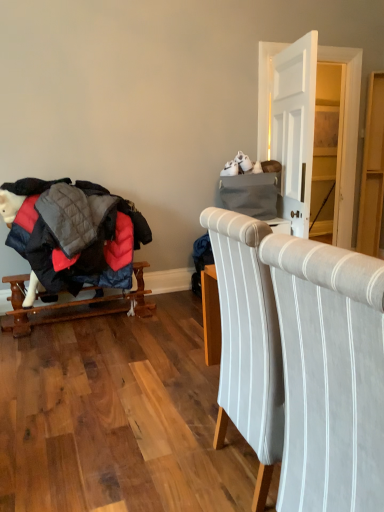
Question: Is matte gray dresser at upper right, arranged as the 1th dresser when viewed from the left, not inside light gray striped fabric chair at center?

Choices:
 (A) no
 (B) yes

Answer: (B)

Question: From the image's perspective, would you say matte gray dresser at upper right, the 2th dresser when ordered from right to left, is positioned over light gray striped fabric chair at center?

Choices:
 (A) no
 (B) yes

Answer: (B)

Question: Is matte gray dresser at upper right, the 2th dresser when ordered from right to left, facing towards light gray striped fabric chair at center?

Choices:
 (A) yes
 (B) no

Answer: (B)

Question: Is light gray striped fabric chair at center located within matte gray dresser at upper right, arranged as the 1th dresser when viewed from the left?

Choices:
 (A) yes
 (B) no

Answer: (B)

Question: Is matte gray dresser at upper right, arranged as the 1th dresser when viewed from the left, taller than light gray striped fabric chair at center?

Choices:
 (A) yes
 (B) no

Answer: (A)

Question: From the image's perspective, relative to wooden rocking horse at left, is light wood dresser at right, the first dresser in the right-to-left sequence, above or below?

Choices:
 (A) above
 (B) below

Answer: (A)

Question: In the image, is light wood dresser at right, the first dresser in the right-to-left sequence, positioned in front of or behind wooden rocking horse at left?

Choices:
 (A) front
 (B) behind

Answer: (B)

Question: Based on their sizes in the image, would you say light wood dresser at right, the first dresser in the right-to-left sequence, is bigger or smaller than wooden rocking horse at left?

Choices:
 (A) small
 (B) big

Answer: (A)

Question: Is light wood dresser at right, which appears as the second dresser when viewed from the left, taller or shorter than wooden rocking horse at left?

Choices:
 (A) short
 (B) tall

Answer: (B)

Question: In terms of size, does light wood dresser at right, which appears as the second dresser when viewed from the left, appear bigger or smaller than matte gray dresser at upper right, arranged as the 1th dresser when viewed from the left?

Choices:
 (A) small
 (B) big

Answer: (A)

Question: Considering their positions, is light wood dresser at right, which appears as the second dresser when viewed from the left, located in front of or behind matte gray dresser at upper right, the 2th dresser when ordered from right to left?

Choices:
 (A) front
 (B) behind

Answer: (B)

Question: From a real-world perspective, is light wood dresser at right, which appears as the second dresser when viewed from the left, above or below matte gray dresser at upper right, arranged as the 1th dresser when viewed from the left?

Choices:
 (A) above
 (B) below

Answer: (B)

Question: Which is correct: light wood dresser at right, the first dresser in the right-to-left sequence, is inside matte gray dresser at upper right, the 2th dresser when ordered from right to left, or outside of it?

Choices:
 (A) inside
 (B) outside

Answer: (B)

Question: Is matte gray dresser at upper right, arranged as the 1th dresser when viewed from the left, inside or outside of wooden rocking horse at left?

Choices:
 (A) inside
 (B) outside

Answer: (B)

Question: From a real-world perspective, relative to wooden rocking horse at left, is matte gray dresser at upper right, arranged as the 1th dresser when viewed from the left, vertically above or below?

Choices:
 (A) above
 (B) below

Answer: (A)